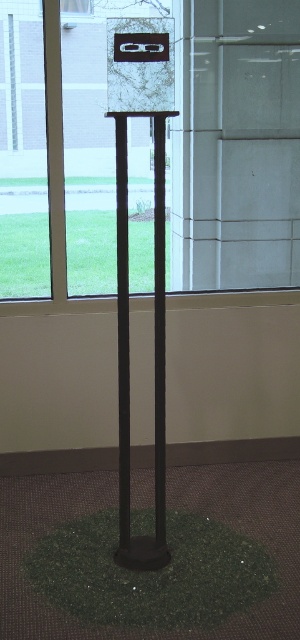
Who is positioned more to the right, green grass at lower center or transparent glass window at upper center?

green grass at lower center is more to the right.

Is point (96, 236) positioned before point (84, 12)?

No, (96, 236) is behind (84, 12).

You are a GUI agent. You are given a task and a screenshot of the screen. Output one action in this format:
    pyautogui.click(x=<x>, y=<y>)
    Task: Click on the green grass at lower center
    
    Given the screenshot: What is the action you would take?
    pyautogui.click(x=90, y=252)